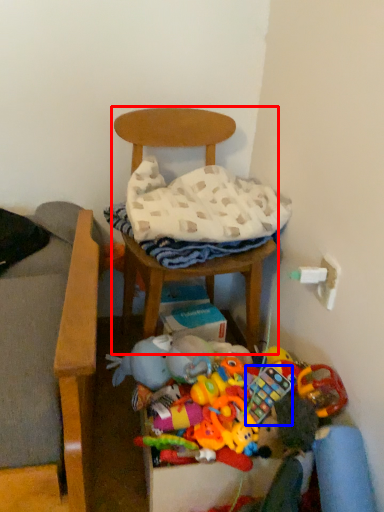
Question: Which of the following is the closest to the observer, chair (highlighted by a red box) or toy (highlighted by a blue box)?

Choices:
 (A) chair
 (B) toy

Answer: (B)